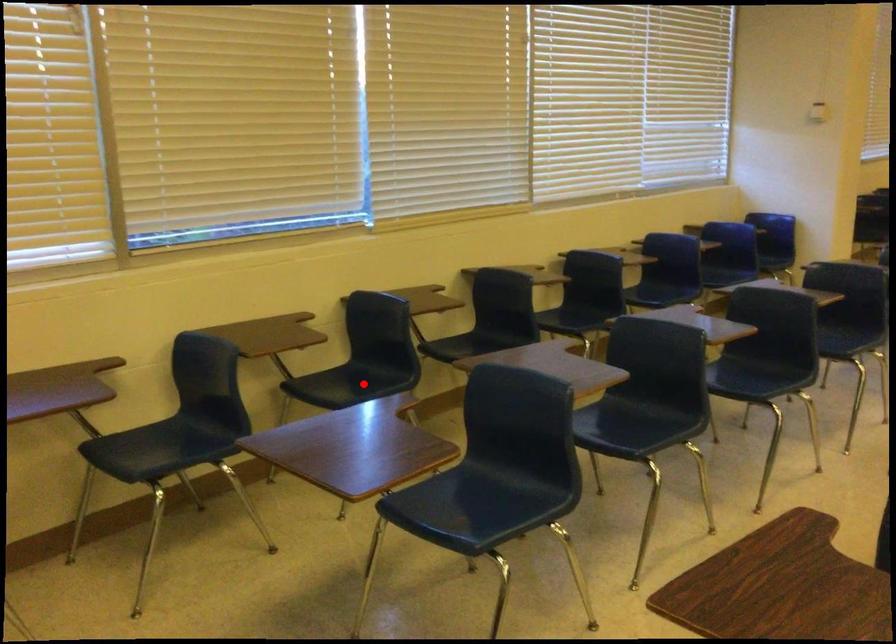
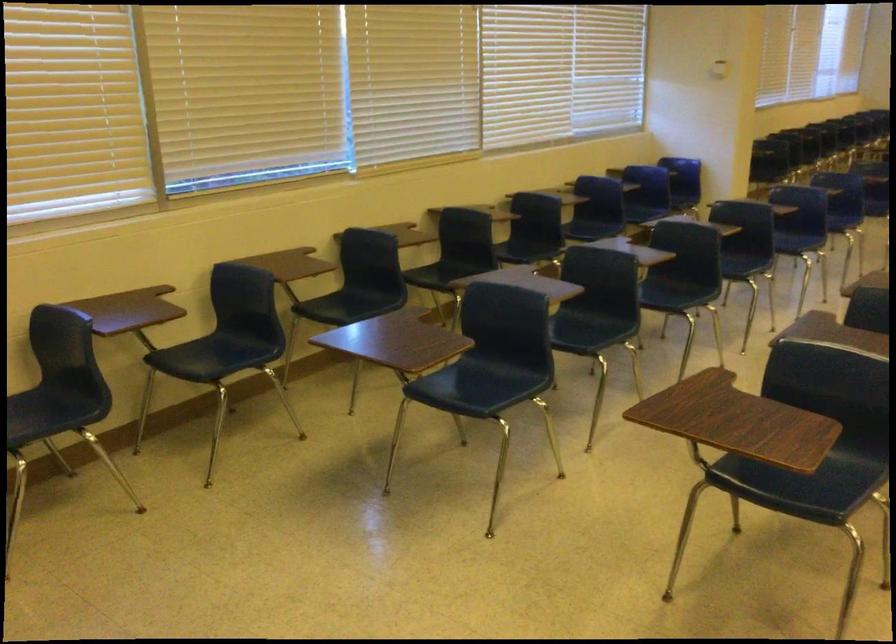
Where in the second image is the point corresponding to the highlighted location from the first image?

(359, 303)